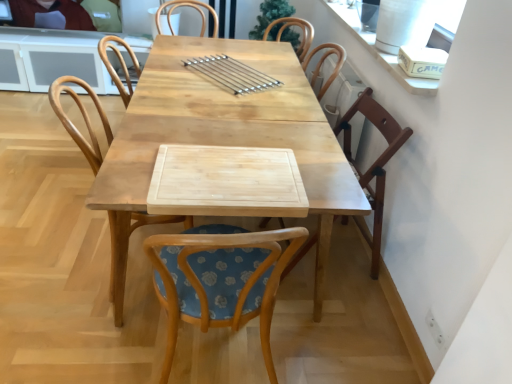
The height and width of the screenshot is (384, 512). What are the coordinates of `free space in front of satin silver skewers at center` in the screenshot? It's located at (201, 104).